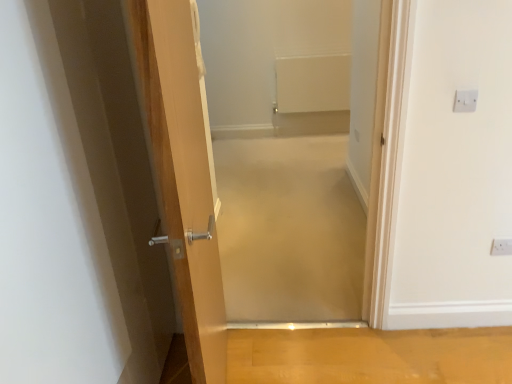
How much space does beige carpet at center, which ranks as the second corridor in back-to-front order, occupy vertically?

1.53 meters.

What do you see at coordinates (292, 153) in the screenshot? I see `beige carpet at center, which ranks as the second corridor in back-to-front order` at bounding box center [292, 153].

In order to face white plastic electric outlet at upper right, which is the first electric outlet from right to left, should I rotate leftwards or rightwards?

A 30.900 degree turn to the right will do.

Measure the distance between point (219, 174) and camera.

Point (219, 174) is 3.93 meters away from camera.

Locate an element on the screen. This screenshot has height=384, width=512. wooden floor at lower center is located at coordinates (370, 355).

Locate an element on the screen. beige carpet at center, the 1th corridor from the front is located at coordinates (292, 153).

Does white plastic electric outlet at upper right, which is the 1th electric outlet from back to front, have a greater height compared to beige carpet at center, placed as the 1th corridor when sorted from back to front?

Yes.

Is white plastic electric outlet at upper right, which is counted as the 2th electric outlet, starting from the left, next to beige carpet at center, which appears as the 2th corridor when viewed from the front?

No, white plastic electric outlet at upper right, which is counted as the 2th electric outlet, starting from the left, is not with beige carpet at center, which appears as the 2th corridor when viewed from the front.

Does point (502, 239) come closer to viewer compared to point (277, 157)?

Yes.

How different are the orientations of wooden floor at lower center and beige carpet at center, which ranks as the second corridor in back-to-front order, in degrees?

There is a 88.9-degree angle between the facing directions of wooden floor at lower center and beige carpet at center, which ranks as the second corridor in back-to-front order.

Can you confirm if wooden floor at lower center is wider than beige carpet at center, the 1th corridor from the front?

Yes.

Locate an element on the screen. corridor that is above the wooden floor at lower center (from a real-world perspective) is located at coordinates (292, 153).

Could you measure the distance between wooden floor at lower center and beige carpet at center, the 1th corridor from the front?

wooden floor at lower center is 30.67 inches away from beige carpet at center, the 1th corridor from the front.

From the image's perspective, is white plastic electric outlet at upper right, which is counted as the 2th electric outlet, starting from the left, positioned above or below beige carpet at center, the 1th corridor from the front?

A: Based on their image positions, white plastic electric outlet at upper right, which is counted as the 2th electric outlet, starting from the left, is located beneath beige carpet at center, the 1th corridor from the front.

Considering the positions of point (503, 245) and point (264, 66), is point (503, 245) closer or farther from the camera than point (264, 66)?

Clearly, point (503, 245) is closer to the camera than point (264, 66).

Considering the sizes of white plastic electric outlet at upper right, which is counted as the 2th electric outlet, starting from the left, and beige carpet at center, which ranks as the second corridor in back-to-front order, in the image, is white plastic electric outlet at upper right, which is counted as the 2th electric outlet, starting from the left, taller or shorter than beige carpet at center, which ranks as the second corridor in back-to-front order,?

Clearly, white plastic electric outlet at upper right, which is counted as the 2th electric outlet, starting from the left, is shorter compared to beige carpet at center, which ranks as the second corridor in back-to-front order.

Looking at this image, does white plastic electric outlet at upper right, which ranks as the 2th electric outlet in right-to-left order, lie in front of beige carpet at center, the 1th corridor from the front?

No, it is not.

Is white plastic electric outlet at upper right, acting as the first electric outlet starting from the left, with beige carpet at center, which ranks as the second corridor in back-to-front order?

They are not placed beside each other.

Is white plastic electric outlet at upper right, acting as the first electric outlet starting from the left, positioned beyond the bounds of beige carpet at center, the 1th corridor from the front?

Yes.

Does white plastic electric outlet at upper right, which is the second electric outlet in bottom-to-top order, turn towards beige carpet at center, the 1th corridor from the front?

No, white plastic electric outlet at upper right, which is the second electric outlet in bottom-to-top order, does not turn towards beige carpet at center, the 1th corridor from the front.

In the scene shown: Who is bigger, white plastic electric outlet at upper right, which ranks as the 2th electric outlet in right-to-left order, or beige carpet at center, placed as the 1th corridor when sorted from back to front?

With larger size is beige carpet at center, placed as the 1th corridor when sorted from back to front.

How far apart are white plastic electric outlet at upper right, which is the 1th electric outlet in top-to-bottom order, and beige carpet at center, which appears as the 2th corridor when viewed from the front?

A distance of 5.52 feet exists between white plastic electric outlet at upper right, which is the 1th electric outlet in top-to-bottom order, and beige carpet at center, which appears as the 2th corridor when viewed from the front.

Is white plastic electric outlet at upper right, acting as the first electric outlet starting from the left, shorter than beige carpet at center, which appears as the 2th corridor when viewed from the front?

No.

Do you think white plastic electric outlet at upper right, which is the second electric outlet in bottom-to-top order, is within beige carpet at center, which appears as the 2th corridor when viewed from the front, or outside of it?

white plastic electric outlet at upper right, which is the second electric outlet in bottom-to-top order, lies outside beige carpet at center, which appears as the 2th corridor when viewed from the front.

Is white plastic electric outlet at upper right, the 2th electric outlet in the top-to-bottom sequence, beside white plastic electric outlet at upper right, the first electric outlet viewed from the front?

No, white plastic electric outlet at upper right, the 2th electric outlet in the top-to-bottom sequence, is not touching white plastic electric outlet at upper right, the first electric outlet viewed from the front.

Which is behind, point (503, 251) or point (464, 100)?

The point (503, 251) is more distant.

How much distance is there between white plastic electric outlet at upper right, the 2th electric outlet in the top-to-bottom sequence, and white plastic electric outlet at upper right, which ranks as the 2th electric outlet in right-to-left order?

A distance of 27.49 inches exists between white plastic electric outlet at upper right, the 2th electric outlet in the top-to-bottom sequence, and white plastic electric outlet at upper right, which ranks as the 2th electric outlet in right-to-left order.

Considering the sizes of white plastic electric outlet at upper right, which is the 1th electric outlet from back to front, and white plastic electric outlet at upper right, which is the second electric outlet in bottom-to-top order, in the image, is white plastic electric outlet at upper right, which is the 1th electric outlet from back to front, taller or shorter than white plastic electric outlet at upper right, which is the second electric outlet in bottom-to-top order,?

In the image, white plastic electric outlet at upper right, which is the 1th electric outlet from back to front, appears to be taller than white plastic electric outlet at upper right, which is the second electric outlet in bottom-to-top order.

Identify the location of the 1st electric outlet to the right when counting from the beige carpet at center, the 1th corridor from the front. The height and width of the screenshot is (384, 512). (465, 101).

Which of these two, beige carpet at center, the 1th corridor from the front, or white plastic electric outlet at upper right, acting as the first electric outlet starting from the left, is bigger?

beige carpet at center, the 1th corridor from the front, is bigger.

Is beige carpet at center, which ranks as the second corridor in back-to-front order, oriented away from white plastic electric outlet at upper right, which is the second electric outlet in bottom-to-top order?

No.

Which of these two, beige carpet at center, the 1th corridor from the front, or white plastic electric outlet at upper right, the second electric outlet from the back, stands taller?

beige carpet at center, the 1th corridor from the front, is taller.

Find the location of `electric outlet that is the 1st one above the beige carpet at center, which appears as the 2th corridor when viewed from the front (from a real-world perspective)`. electric outlet that is the 1st one above the beige carpet at center, which appears as the 2th corridor when viewed from the front (from a real-world perspective) is located at coordinates (501, 247).

From the image's perspective, count 2nd corridors upward from the wooden floor at lower center and point to it. Please provide its 2D coordinates.

[(292, 153)]

Which object lies further to the anchor point wooden floor at lower center, white plastic electric outlet at upper right, which is the 1th electric outlet from back to front, or white plastic electric outlet at upper right, acting as the first electric outlet starting from the left?

white plastic electric outlet at upper right, acting as the first electric outlet starting from the left, lies further to wooden floor at lower center than the other object.

Considering their positions, is wooden floor at lower center positioned further to white plastic electric outlet at upper right, which is the 1th electric outlet from back to front, than white plastic electric outlet at upper right, the first electric outlet viewed from the front?

Among the two, wooden floor at lower center is located further to white plastic electric outlet at upper right, which is the 1th electric outlet from back to front.

From the image, which object appears to be farther from beige carpet at center, the 1th corridor from the front, white plastic electric outlet at upper right, which is the 1th electric outlet in top-to-bottom order, or white plastic electric outlet at upper right, which is the 1th electric outlet from back to front?

The object further to beige carpet at center, the 1th corridor from the front, is white plastic electric outlet at upper right, which is the 1th electric outlet in top-to-bottom order.

Looking at the image, which one is located closer to beige carpet at center, the 1th corridor from the front, white plastic electric outlet at upper right, which is the first electric outlet from right to left, or wooden floor at lower center?

The object closer to beige carpet at center, the 1th corridor from the front, is wooden floor at lower center.

Looking at the image, which one is located further to beige carpet at center, which ranks as the second corridor in back-to-front order, wooden floor at lower center or white plastic electric outlet at upper right, which is the second electric outlet in front-to-back order?

Among the two, white plastic electric outlet at upper right, which is the second electric outlet in front-to-back order, is located further to beige carpet at center, which ranks as the second corridor in back-to-front order.

Considering their positions, is white plastic electric outlet at upper right, which is counted as the 2th electric outlet, starting from the left, positioned further to beige carpet at center, which ranks as the second corridor in back-to-front order, than beige carpet at center, which appears as the 2th corridor when viewed from the front?

white plastic electric outlet at upper right, which is counted as the 2th electric outlet, starting from the left, lies further to beige carpet at center, which ranks as the second corridor in back-to-front order, than the other object.

Looking at the image, which one is located closer to wooden floor at lower center, beige carpet at center, which ranks as the second corridor in back-to-front order, or white plastic electric outlet at upper right, which is the 1th electric outlet from back to front?

white plastic electric outlet at upper right, which is the 1th electric outlet from back to front, is positioned closer to the anchor wooden floor at lower center.

In the scene shown: Looking at the image, which one is located further to white plastic electric outlet at upper right, which is the second electric outlet in bottom-to-top order, wooden floor at lower center or beige carpet at center, placed as the 1th corridor when sorted from back to front?

beige carpet at center, placed as the 1th corridor when sorted from back to front, lies further to white plastic electric outlet at upper right, which is the second electric outlet in bottom-to-top order, than the other object.

Where is `corridor between beige carpet at center, which ranks as the second corridor in back-to-front order, and wooden floor at lower center vertically`? The image size is (512, 384). corridor between beige carpet at center, which ranks as the second corridor in back-to-front order, and wooden floor at lower center vertically is located at coordinates (289, 230).

You are a GUI agent. You are given a task and a screenshot of the screen. Output one action in this format:
    pyautogui.click(x=<x>, y=<y>)
    Task: Click on the electric outlet between beige carpet at center, which appears as the 2th corridor when viewed from the front, and white plastic electric outlet at upper right, which is counted as the 2th electric outlet, starting from the left, in the horizontal direction
    This screenshot has height=384, width=512.
    Given the screenshot: What is the action you would take?
    click(465, 101)

The image size is (512, 384). I want to click on plain between beige carpet at center, the 1th corridor from the front, and white plastic electric outlet at upper right, which is the first electric outlet from right to left, so click(370, 355).

Where is `plain located between beige carpet at center, placed as the 1th corridor when sorted from back to front, and white plastic electric outlet at upper right, the 2th electric outlet in the top-to-bottom sequence, in the left-right direction`? The height and width of the screenshot is (384, 512). plain located between beige carpet at center, placed as the 1th corridor when sorted from back to front, and white plastic electric outlet at upper right, the 2th electric outlet in the top-to-bottom sequence, in the left-right direction is located at coordinates (370, 355).